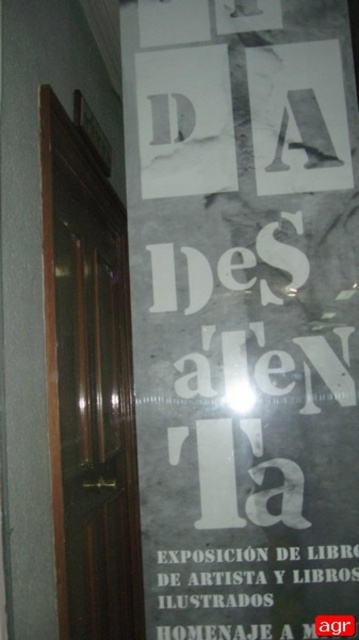
What is the relationship in size between the white paper poster at center and the brown polished wood door at left?

The white paper poster at center is smaller than the brown polished wood door at left.

You are standing in front of a glass door frame and see both the white paper poster at center and the white paper sign at lower center. Which object is closer to you?

The white paper poster at center is closer to you because the white paper sign at lower center is behind it.

In the scene shown: What is the relationship between the height of the brown polished wood door at left and the white paper sign at lower center?

The brown polished wood door at left is taller than the white paper sign at lower center.